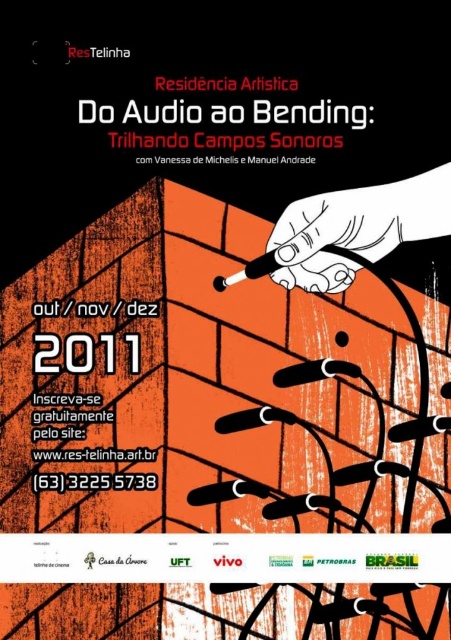
From the picture: Looking at the promotional poster for the artistic residency event, you notice two items at the center. Which one is positioned to the right of the other? The items are the white matte pencil at center and the white paper at center.

The white matte pencil at center is to the right of the white paper at center.

You are an artist preparing to draw on the white paper at center. You notice a white matte pencil at center nearby. Which object is taller when placed side by side?

The white matte pencil at center is taller than the white paper at center according to the description.